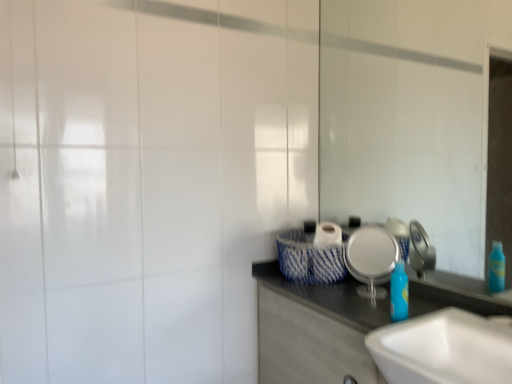
Question: Does white glossy cabinet at lower right have a smaller size compared to white glossy mirror at upper right?

Choices:
 (A) no
 (B) yes

Answer: (A)

Question: Does white glossy cabinet at lower right have a greater width compared to white glossy mirror at upper right?

Choices:
 (A) no
 (B) yes

Answer: (B)

Question: From the image's perspective, does white glossy cabinet at lower right appear higher than white glossy mirror at upper right?

Choices:
 (A) no
 (B) yes

Answer: (A)

Question: Is white glossy cabinet at lower right aimed at white glossy mirror at upper right?

Choices:
 (A) no
 (B) yes

Answer: (A)

Question: From the image's perspective, is white glossy cabinet at lower right beneath white glossy mirror at upper right?

Choices:
 (A) no
 (B) yes

Answer: (B)

Question: Relative to blue plastic bottle at center, is white glossy sink at lower right in front or behind?

Choices:
 (A) front
 (B) behind

Answer: (A)

Question: In terms of width, does white glossy sink at lower right look wider or thinner when compared to blue plastic bottle at center?

Choices:
 (A) thin
 (B) wide

Answer: (B)

Question: Based on their sizes in the image, would you say white glossy sink at lower right is bigger or smaller than blue plastic bottle at center?

Choices:
 (A) small
 (B) big

Answer: (B)

Question: From their relative heights in the image, would you say white glossy sink at lower right is taller or shorter than blue plastic bottle at center?

Choices:
 (A) tall
 (B) short

Answer: (A)

Question: Considering the positions of point (467, 147) and point (394, 271), is point (467, 147) closer or farther from the camera than point (394, 271)?

Choices:
 (A) farther
 (B) closer

Answer: (A)

Question: From a real-world perspective, relative to blue plastic bottle at center, is white glossy mirror at upper right vertically above or below?

Choices:
 (A) below
 (B) above

Answer: (B)

Question: Which is correct: white glossy mirror at upper right is inside blue plastic bottle at center, or outside of it?

Choices:
 (A) outside
 (B) inside

Answer: (A)

Question: In terms of height, does white glossy mirror at upper right look taller or shorter compared to blue plastic bottle at center?

Choices:
 (A) tall
 (B) short

Answer: (A)

Question: Which is correct: blue plastic bottle at center is inside silver metallic plate at center, or outside of it?

Choices:
 (A) outside
 (B) inside

Answer: (A)

Question: Considering the positions of blue plastic bottle at center and silver metallic plate at center in the image, is blue plastic bottle at center wider or thinner than silver metallic plate at center?

Choices:
 (A) thin
 (B) wide

Answer: (A)